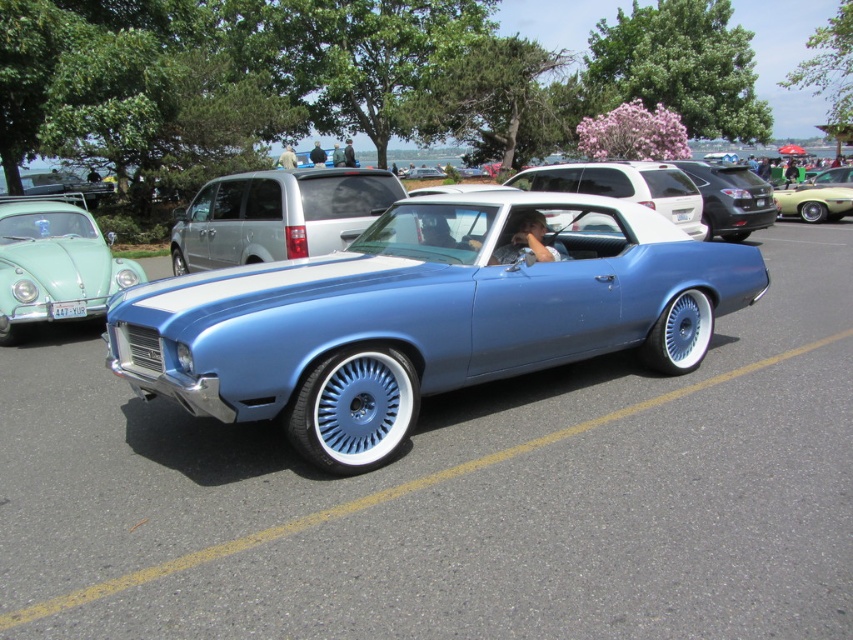
You are standing at the viewpoint of the image and want to walk from point A to point B. The points are labeled as follows in the image description. Point A is at point (189, 208) and point B is at point (57, 321). Which direction should you move to go from point A to point B?

To go from point A at (189, 208) to point B at (57, 321), you should move forward because point A is behind point B according to the spatial relationship described.

You are standing at the entrance of the car event and want to locate the metallic blue convertible at center. According to the coordinates provided, where should you look?

The metallic blue convertible at center is located at coordinates point (426, 316), which is nearly the center of the image.

You are standing in front of the blue 1970 Oldsmobile Cutlass Supreme at the classic car event. There are two points marked on the car, one at coordinate point [106,276] and another at coordinate point [672,195]. Which of these points is nearer to you?

Point [106,276] is closer to the viewer than point [672,195].